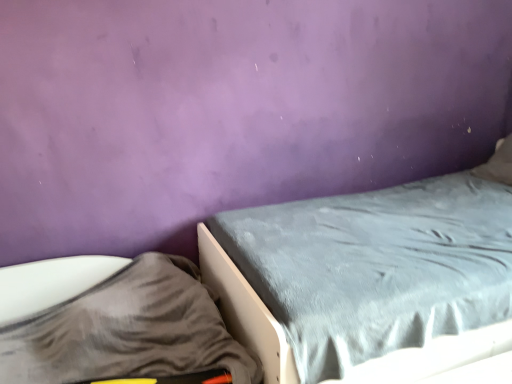
Question: Should I look upward or downward to see velvet gray bed at center?

Choices:
 (A) up
 (B) down

Answer: (B)

Question: Is gray fabric sheet at lower left taller than velvet gray bed at center?

Choices:
 (A) no
 (B) yes

Answer: (A)

Question: Is gray fabric sheet at lower left outside velvet gray bed at center?

Choices:
 (A) yes
 (B) no

Answer: (A)

Question: Is gray fabric sheet at lower left to the right of velvet gray bed at center from the viewer's perspective?

Choices:
 (A) yes
 (B) no

Answer: (B)

Question: Is gray fabric sheet at lower left positioned before velvet gray bed at center?

Choices:
 (A) no
 (B) yes

Answer: (B)

Question: Is the position of gray fabric sheet at lower left more distant than that of velvet gray bed at center?

Choices:
 (A) yes
 (B) no

Answer: (B)

Question: Can you confirm if gray fabric sheet at lower left is bigger than velvet gray bed at center?

Choices:
 (A) yes
 (B) no

Answer: (B)

Question: Would you consider velvet gray bed at center to be distant from gray fabric sheet at lower left?

Choices:
 (A) no
 (B) yes

Answer: (A)

Question: Does velvet gray bed at center touch gray fabric sheet at lower left?

Choices:
 (A) no
 (B) yes

Answer: (A)

Question: From the image's perspective, is velvet gray bed at center over gray fabric sheet at lower left?

Choices:
 (A) no
 (B) yes

Answer: (B)

Question: Is velvet gray bed at center at the left side of gray fabric sheet at lower left?

Choices:
 (A) no
 (B) yes

Answer: (A)

Question: Considering the relative sizes of velvet gray bed at center and gray fabric sheet at lower left in the image provided, is velvet gray bed at center wider than gray fabric sheet at lower left?

Choices:
 (A) yes
 (B) no

Answer: (A)

Question: Considering the relative positions of velvet gray bed at center and gray fabric sheet at lower left in the image provided, is velvet gray bed at center in front of gray fabric sheet at lower left?

Choices:
 (A) no
 (B) yes

Answer: (A)

Question: Does point (404, 379) appear closer or farther from the camera than point (40, 301)?

Choices:
 (A) closer
 (B) farther

Answer: (A)